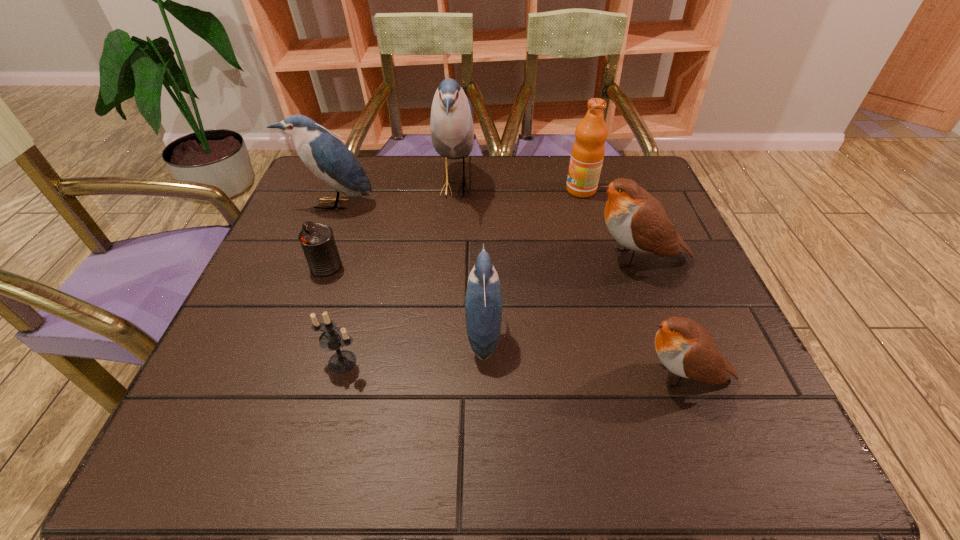
You are a GUI agent. You are given a task and a screenshot of the screen. Output one action in this format:
    pyautogui.click(x=<x>, y=<y>)
    Task: Click on the tallest object
    This screenshot has width=960, height=540.
    Given the screenshot: What is the action you would take?
    pyautogui.click(x=451, y=122)

You are a GUI agent. You are given a task and a screenshot of the screen. Output one action in this format:
    pyautogui.click(x=<x>, y=<y>)
    Task: Click on the tallest bird
    
    Given the screenshot: What is the action you would take?
    pyautogui.click(x=451, y=122)

Find the location of a particular element. fruit juice is located at coordinates (588, 150).

What are the coordinates of `the second biggest blue bird` in the screenshot? It's located at (327, 157).

Find the location of a particular element. The image size is (960, 540). the second tallest bird is located at coordinates (327, 157).

This screenshot has width=960, height=540. I want to click on the bigger brown bird, so click(x=636, y=220).

Where is `the farther brown bird`? The width and height of the screenshot is (960, 540). the farther brown bird is located at coordinates tap(636, 220).

This screenshot has height=540, width=960. Find the location of `the nearest blue bird`. the nearest blue bird is located at coordinates (483, 302).

Locate an element on the screen. This screenshot has height=540, width=960. the nearer brown bird is located at coordinates point(687,349).

At what (x,y) coordinates should I click in order to perform the action: click on the shortest bird. Please return your answer as a coordinate pair (x, y). The width and height of the screenshot is (960, 540). Looking at the image, I should click on (687, 349).